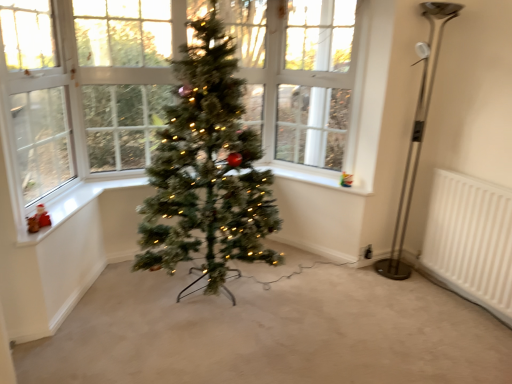
Question: Could you tell me if clear glass window at left, which ranks as the first window screen in left-to-right order, is turned towards polished metal floor lamp at right?

Choices:
 (A) no
 (B) yes

Answer: (B)

Question: From the image's perspective, is clear glass window at left, which ranks as the first window screen in left-to-right order, beneath polished metal floor lamp at right?

Choices:
 (A) yes
 (B) no

Answer: (B)

Question: Does clear glass window at left, the 1th window screen positioned from the front, contain polished metal floor lamp at right?

Choices:
 (A) yes
 (B) no

Answer: (B)

Question: Can you confirm if clear glass window at left, which ranks as the first window screen in left-to-right order, is taller than polished metal floor lamp at right?

Choices:
 (A) no
 (B) yes

Answer: (A)

Question: Is clear glass window at left, which ranks as the first window screen in left-to-right order, thinner than polished metal floor lamp at right?

Choices:
 (A) yes
 (B) no

Answer: (A)

Question: Is white plastic at upper center, which is counted as the first window sill, starting from the right, wider or thinner than clear glass window at left, which is the second window screen from right to left?

Choices:
 (A) wide
 (B) thin

Answer: (B)

Question: From the image's perspective, is white plastic at upper center, which is counted as the 1th window sill, starting from the back, positioned above or below clear glass window at left, which ranks as the first window screen in left-to-right order?

Choices:
 (A) below
 (B) above

Answer: (A)

Question: From a real-world perspective, is white plastic at upper center, which is counted as the 1th window sill, starting from the back, physically located above or below clear glass window at left, which ranks as the first window screen in left-to-right order?

Choices:
 (A) above
 (B) below

Answer: (B)

Question: Is white plastic at upper center, acting as the second window sill starting from the left, situated inside clear glass window at left, which is the second window screen from right to left, or outside?

Choices:
 (A) inside
 (B) outside

Answer: (B)

Question: Does point (446, 18) appear closer or farther from the camera than point (27, 195)?

Choices:
 (A) closer
 (B) farther

Answer: (B)

Question: Considering the positions of polished metal floor lamp at right and clear glass window at left, which is the second window screen from right to left, in the image, is polished metal floor lamp at right bigger or smaller than clear glass window at left, which is the second window screen from right to left,?

Choices:
 (A) small
 (B) big

Answer: (B)

Question: Looking at their shapes, would you say polished metal floor lamp at right is wider or thinner than clear glass window at left, which ranks as the first window screen in left-to-right order?

Choices:
 (A) thin
 (B) wide

Answer: (B)

Question: From a real-world perspective, is polished metal floor lamp at right positioned above or below clear glass window at left, the 1th window screen positioned from the front?

Choices:
 (A) above
 (B) below

Answer: (B)

Question: In terms of size, does clear glass window at left, which is the second window screen in back-to-front order, appear bigger or smaller than clear glass window at upper center, which appears as the first window screen when viewed from the back?

Choices:
 (A) small
 (B) big

Answer: (B)

Question: From a real-world perspective, is clear glass window at left, which is the second window screen in back-to-front order, positioned above or below clear glass window at upper center, the first window screen positioned from the right?

Choices:
 (A) above
 (B) below

Answer: (B)